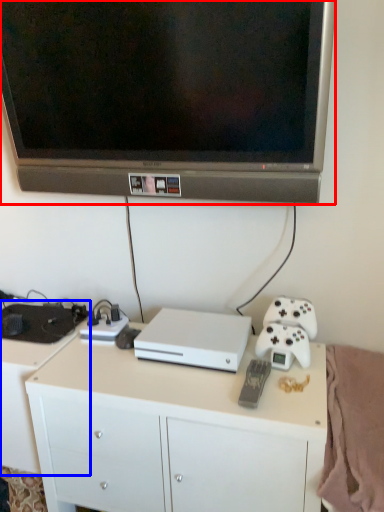
Question: Which of the following is the farthest to the observer, television (highlighted by a red box) or desk (highlighted by a blue box)?

Choices:
 (A) television
 (B) desk

Answer: (B)